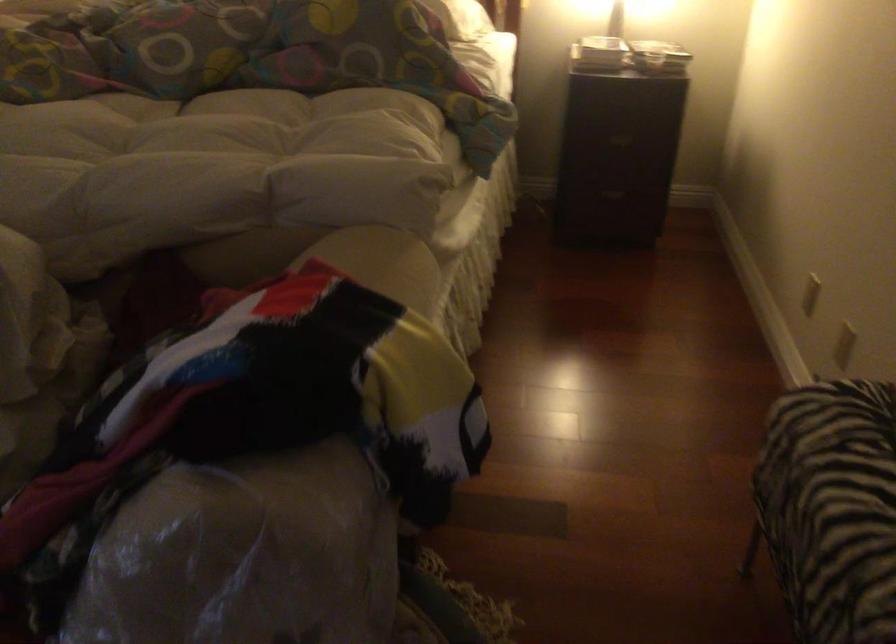
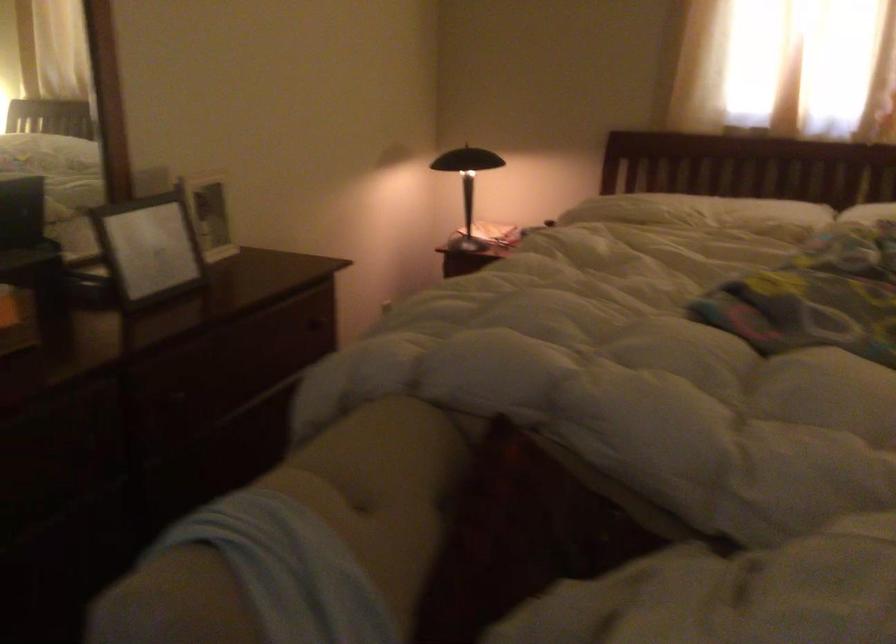
Question: In a continuous first-person perspective shot, in which direction is the camera moving?

Choices:
 (A) Left
 (B) Right
 (C) Forward
 (D) Backward

Answer: (A)